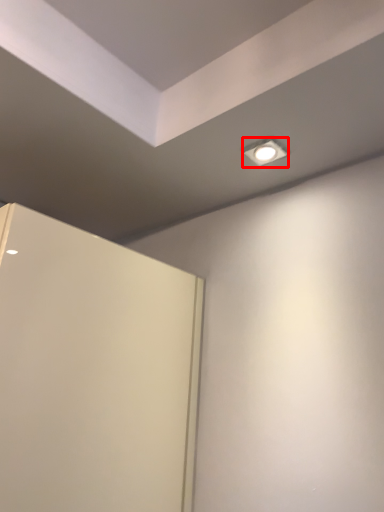
Question: From the image's perspective, what is the correct spatial positioning of lighting (annotated by the red box) in reference to door?

Choices:
 (A) above
 (B) below

Answer: (A)